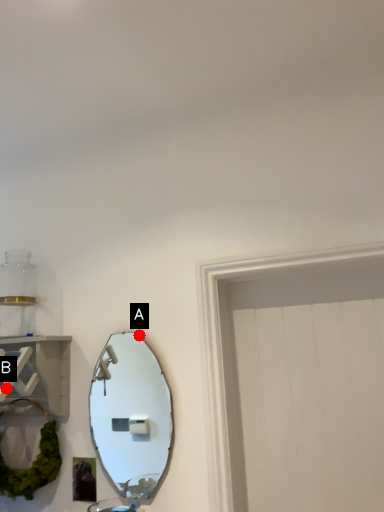
Question: Two points are circled on the image, labeled by A and B beside each circle. Which point is farther to the camera?

Choices:
 (A) A is further
 (B) B is further

Answer: (A)